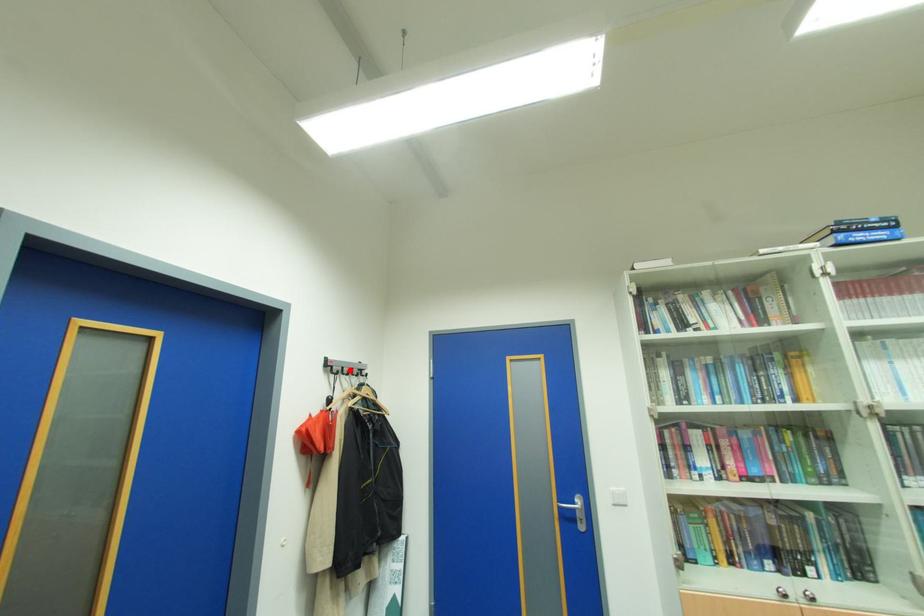
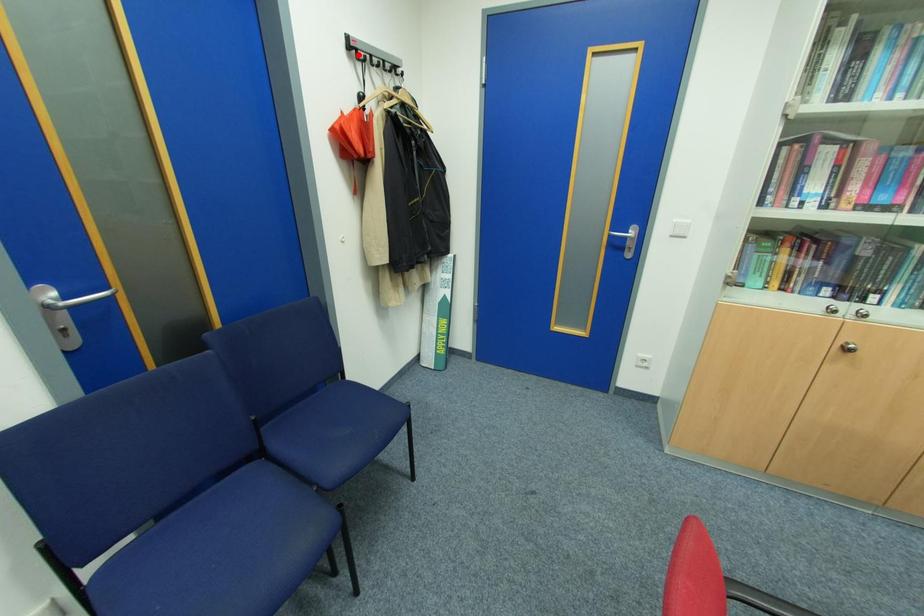
I am providing you with two images of the same scene from different viewpoints. A red point is marked on the first image and another point is marked on the second image. Are the points marked in image1 and image2 representing the same 3D position?

No